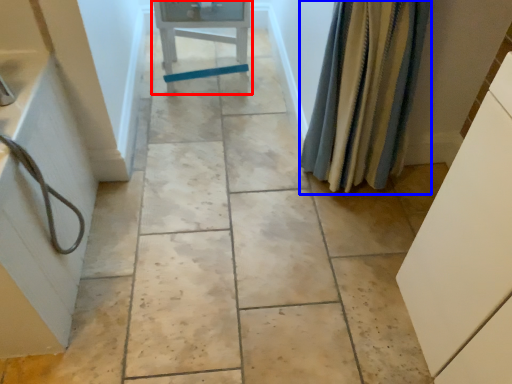
Question: Which object appears farthest to the camera in this image, furniture (highlighted by a red box) or shower curtain (highlighted by a blue box)?

Choices:
 (A) furniture
 (B) shower curtain

Answer: (A)